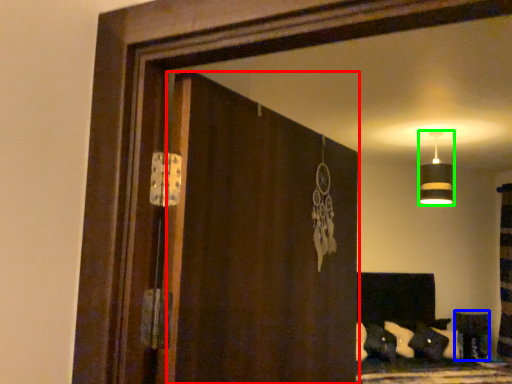
Question: Which object is the farthest from screen door (highlighted by a red box)? Choose among these: furniture (highlighted by a blue box) or lamp (highlighted by a green box).

Choices:
 (A) furniture
 (B) lamp

Answer: (A)